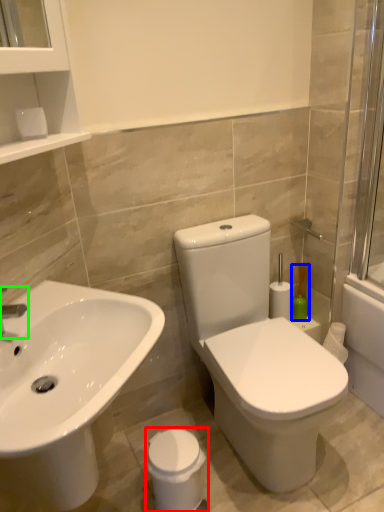
Question: Which object is positioned closest to porcelain (highlighted by a red box)? Select from soap dispenser (highlighted by a blue box) and tap (highlighted by a green box).

Choices:
 (A) soap dispenser
 (B) tap

Answer: (B)